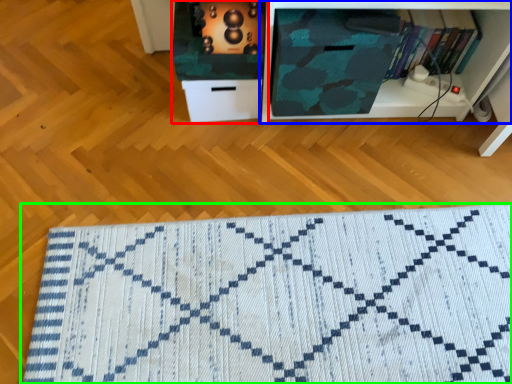
Question: Which is nearer to the cabinetry (highlighted by a red box)? shelf (highlighted by a blue box) or doormat (highlighted by a green box).

Choices:
 (A) shelf
 (B) doormat

Answer: (A)